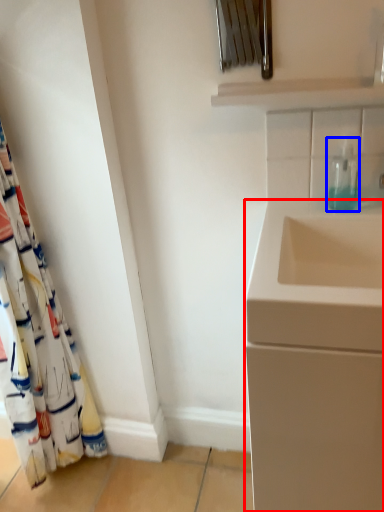
Question: Which object is closer to the camera taking this photo, bathroom cabinet (highlighted by a red box) or soap dispenser (highlighted by a blue box)?

Choices:
 (A) bathroom cabinet
 (B) soap dispenser

Answer: (A)